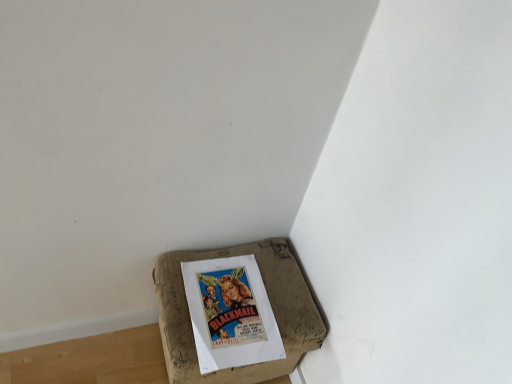
Question: Considering the relative sizes of vintage paper poster at bottom corner and brown cardboard box at lower left in the image provided, is vintage paper poster at bottom corner smaller than brown cardboard box at lower left?

Choices:
 (A) yes
 (B) no

Answer: (A)

Question: Does vintage paper poster at bottom corner lie in front of brown cardboard box at lower left?

Choices:
 (A) no
 (B) yes

Answer: (A)

Question: Does vintage paper poster at bottom corner have a larger size compared to brown cardboard box at lower left?

Choices:
 (A) yes
 (B) no

Answer: (B)

Question: Does vintage paper poster at bottom corner have a lesser height compared to brown cardboard box at lower left?

Choices:
 (A) yes
 (B) no

Answer: (A)

Question: From the image's perspective, does vintage paper poster at bottom corner appear higher than brown cardboard box at lower left?

Choices:
 (A) no
 (B) yes

Answer: (B)

Question: Is vintage paper poster at bottom corner taller than brown cardboard box at lower left?

Choices:
 (A) yes
 (B) no

Answer: (B)

Question: Is brown cardboard box at lower left to the left of vintage paper poster at bottom corner from the viewer's perspective?

Choices:
 (A) no
 (B) yes

Answer: (B)

Question: From a real-world perspective, is brown cardboard box at lower left on vintage paper poster at bottom corner?

Choices:
 (A) no
 (B) yes

Answer: (A)

Question: From the image's perspective, would you say brown cardboard box at lower left is shown under vintage paper poster at bottom corner?

Choices:
 (A) no
 (B) yes

Answer: (B)

Question: Can we say brown cardboard box at lower left lies outside vintage paper poster at bottom corner?

Choices:
 (A) yes
 (B) no

Answer: (A)

Question: Considering the relative sizes of brown cardboard box at lower left and vintage paper poster at bottom corner in the image provided, is brown cardboard box at lower left bigger than vintage paper poster at bottom corner?

Choices:
 (A) no
 (B) yes

Answer: (B)

Question: Is vintage paper poster at bottom corner surrounded by brown cardboard box at lower left?

Choices:
 (A) no
 (B) yes

Answer: (B)

Question: Considering the positions of vintage paper poster at bottom corner and brown cardboard box at lower left in the image, is vintage paper poster at bottom corner taller or shorter than brown cardboard box at lower left?

Choices:
 (A) short
 (B) tall

Answer: (A)